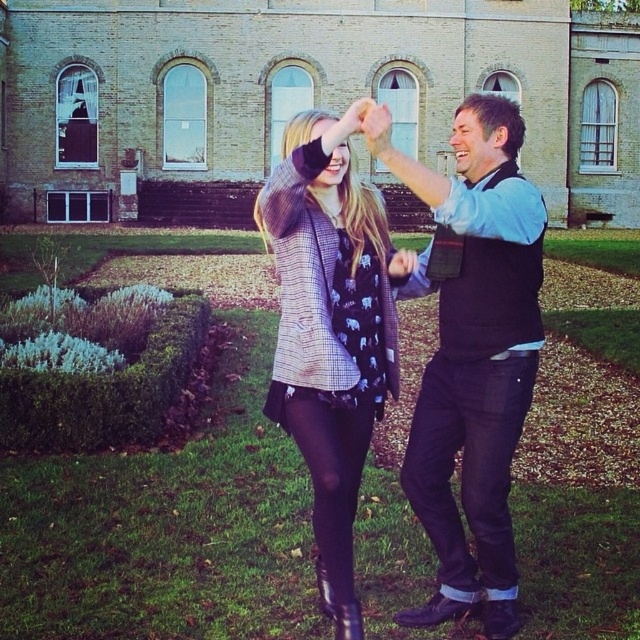
Question: Is black matte vest at center above plaid woolen jacket at center?

Choices:
 (A) yes
 (B) no

Answer: (A)

Question: Considering the relative positions of black matte vest at center and plaid woolen jacket at center in the image provided, where is black matte vest at center located with respect to plaid woolen jacket at center?

Choices:
 (A) left
 (B) right

Answer: (B)

Question: Which point is closer to the camera taking this photo?

Choices:
 (A) (356, 193)
 (B) (538, 237)

Answer: (B)

Question: Does black matte vest at center lie behind plaid woolen jacket at center?

Choices:
 (A) yes
 (B) no

Answer: (A)

Question: Which of the following is the closest to the observer?

Choices:
 (A) (396, 360)
 (B) (500, 513)

Answer: (B)